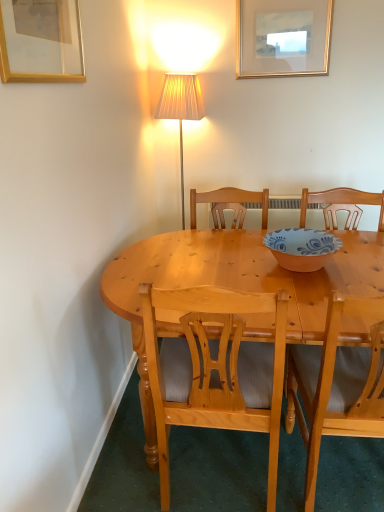
Question: Considering the relative positions of gold/glass picture frame at upper left, the 1th picture frame viewed from the left, and light brown wooden chair at center, acting as the second chair starting from the right, in the image provided, is gold/glass picture frame at upper left, the 1th picture frame viewed from the left, to the left of light brown wooden chair at center, acting as the second chair starting from the right, from the viewer's perspective?

Choices:
 (A) yes
 (B) no

Answer: (A)

Question: Is gold/glass picture frame at upper left, which is counted as the 2th picture frame, starting from the back, positioned beyond the bounds of light brown wooden chair at center, marked as the first chair in a left-to-right arrangement?

Choices:
 (A) no
 (B) yes

Answer: (B)

Question: From a real-world perspective, is gold/glass picture frame at upper left, acting as the 1th picture frame starting from the front, located higher than light brown wooden chair at center, marked as the first chair in a left-to-right arrangement?

Choices:
 (A) no
 (B) yes

Answer: (B)

Question: Is gold/glass picture frame at upper left, which is counted as the 2th picture frame, starting from the back, taller than light brown wooden chair at center, marked as the first chair in a left-to-right arrangement?

Choices:
 (A) yes
 (B) no

Answer: (B)

Question: Can you confirm if gold/glass picture frame at upper left, arranged as the second picture frame when viewed from the top, is wider than light brown wooden chair at center, marked as the first chair in a left-to-right arrangement?

Choices:
 (A) no
 (B) yes

Answer: (A)

Question: Does gold/glass picture frame at upper left, the 1th picture frame viewed from the left, have a smaller size compared to light brown wooden chair at center, marked as the first chair in a left-to-right arrangement?

Choices:
 (A) no
 (B) yes

Answer: (B)

Question: Is light brown wooden chair at center, marked as the first chair in a left-to-right arrangement, outside light wood chair at center, which ranks as the second chair in left-to-right order?

Choices:
 (A) no
 (B) yes

Answer: (B)

Question: Are light brown wooden chair at center, acting as the second chair starting from the right, and light wood chair at center, placed as the 1th chair when sorted from right to left, far apart?

Choices:
 (A) no
 (B) yes

Answer: (A)

Question: Is light wood chair at center, which ranks as the second chair in left-to-right order, at the back of light brown wooden chair at center, acting as the second chair starting from the right?

Choices:
 (A) no
 (B) yes

Answer: (A)

Question: Is light brown wooden chair at center, acting as the second chair starting from the right, positioned before light wood chair at center, which ranks as the second chair in left-to-right order?

Choices:
 (A) no
 (B) yes

Answer: (A)

Question: Considering the relative sizes of light brown wooden chair at center, acting as the second chair starting from the right, and light wood chair at center, placed as the 1th chair when sorted from right to left, in the image provided, is light brown wooden chair at center, acting as the second chair starting from the right, bigger than light wood chair at center, placed as the 1th chair when sorted from right to left,?

Choices:
 (A) yes
 (B) no

Answer: (A)

Question: From the image's perspective, does light brown wooden chair at center, marked as the first chair in a left-to-right arrangement, appear higher than light wood chair at center, which ranks as the second chair in left-to-right order?

Choices:
 (A) no
 (B) yes

Answer: (B)

Question: From a real-world perspective, is light brown wooden chair at center, marked as the first chair in a left-to-right arrangement, physically above gold-framed picture at upper center, the second picture frame when ordered from bottom to top?

Choices:
 (A) no
 (B) yes

Answer: (A)